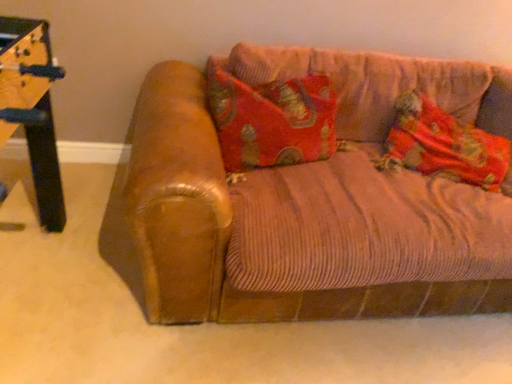
Question: In the image, is brown leather couch at center positioned in front of or behind velvet-like fabric pillow at right?

Choices:
 (A) behind
 (B) front

Answer: (B)

Question: Is point (464, 311) closer or farther from the camera than point (478, 162)?

Choices:
 (A) farther
 (B) closer

Answer: (B)

Question: In terms of size, does brown leather couch at center appear bigger or smaller than velvet-like fabric pillow at right?

Choices:
 (A) small
 (B) big

Answer: (B)

Question: Is velvet-like fabric pillow at right bigger or smaller than brown leather couch at center?

Choices:
 (A) small
 (B) big

Answer: (A)

Question: Which is correct: velvet-like fabric pillow at right is inside brown leather couch at center, or outside of it?

Choices:
 (A) inside
 (B) outside

Answer: (A)

Question: From the image's perspective, is velvet-like fabric pillow at right positioned above or below brown leather couch at center?

Choices:
 (A) below
 (B) above

Answer: (B)

Question: From a real-world perspective, relative to brown leather couch at center, is velvet-like fabric pillow at right vertically above or below?

Choices:
 (A) below
 (B) above

Answer: (B)